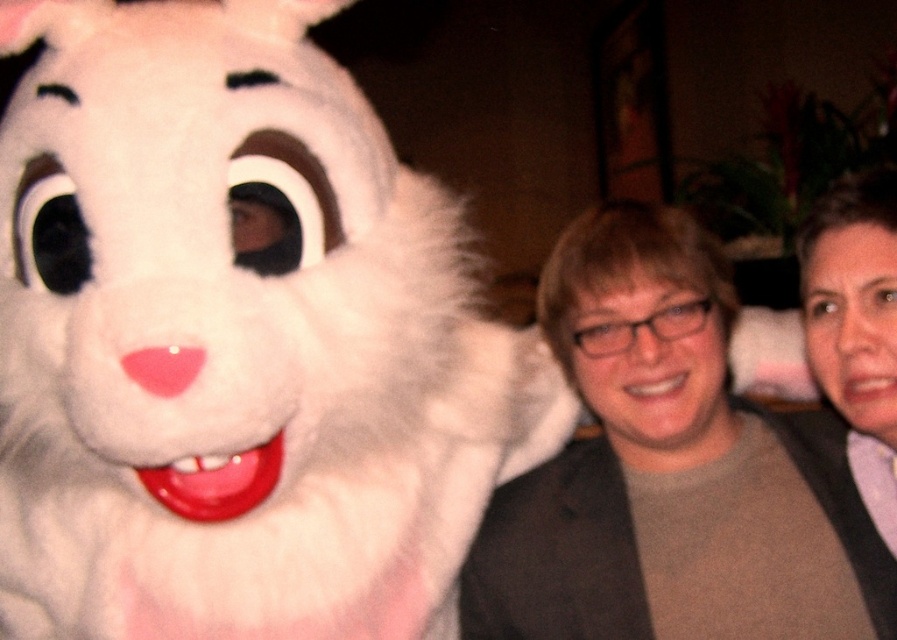
You are taking a photo of the bunny costume and two people in the scene. You want to focus on the point closer to the camera. Which point should you choose between point (845, 580) and point (865, 312)?

Point (845, 580) is further to the camera than point (865, 312), so you should choose point (845, 580) to focus on the closer point.